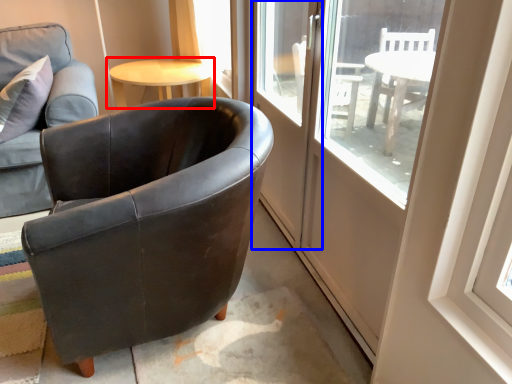
Question: Which object appears closest to the camera in this image, table (highlighted by a red box) or screen door (highlighted by a blue box)?

Choices:
 (A) table
 (B) screen door

Answer: (B)